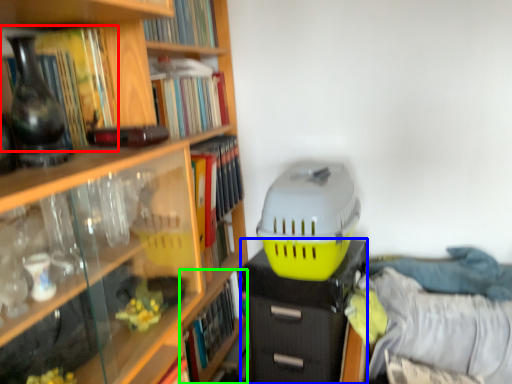
Question: Based on their relative distances, which object is farther from book (highlighted by a red box)? Choose from file cabinet (highlighted by a blue box) and book (highlighted by a green box).

Choices:
 (A) file cabinet
 (B) book

Answer: (B)